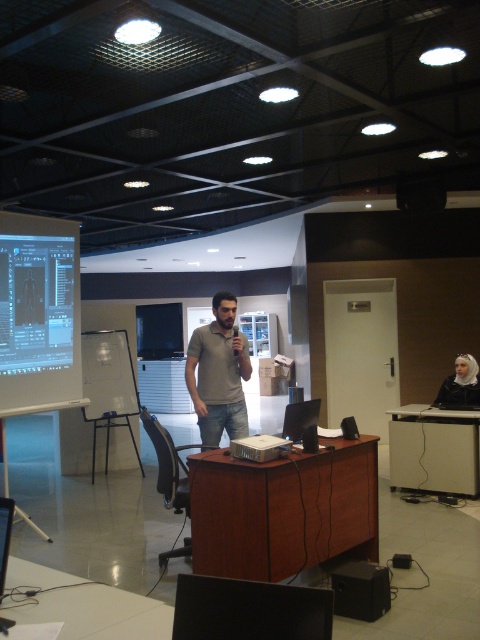
Question: Can you confirm if white glossy projector screen at left is positioned to the left of white glossy table at lower left?

Choices:
 (A) yes
 (B) no

Answer: (A)

Question: Is white glossy projector screen at left further to the viewer compared to white glossy table at lower left?

Choices:
 (A) yes
 (B) no

Answer: (A)

Question: Is white matte table at lower right wider than matte gray shirt at center?

Choices:
 (A) yes
 (B) no

Answer: (A)

Question: Which point is closer to the camera taking this photo?

Choices:
 (A) (290, 576)
 (B) (446, 413)
 (C) (190, 394)
 (D) (29, 573)

Answer: (D)

Question: Estimate the real-world distances between objects in this image. Which object is farther from the white glossy projector screen at left?

Choices:
 (A) matte gray shirt at center
 (B) white matte table at lower right

Answer: (B)

Question: Among these objects, which one is farthest from the camera?

Choices:
 (A) brown wood table at center
 (B) white glossy projector screen at left

Answer: (B)